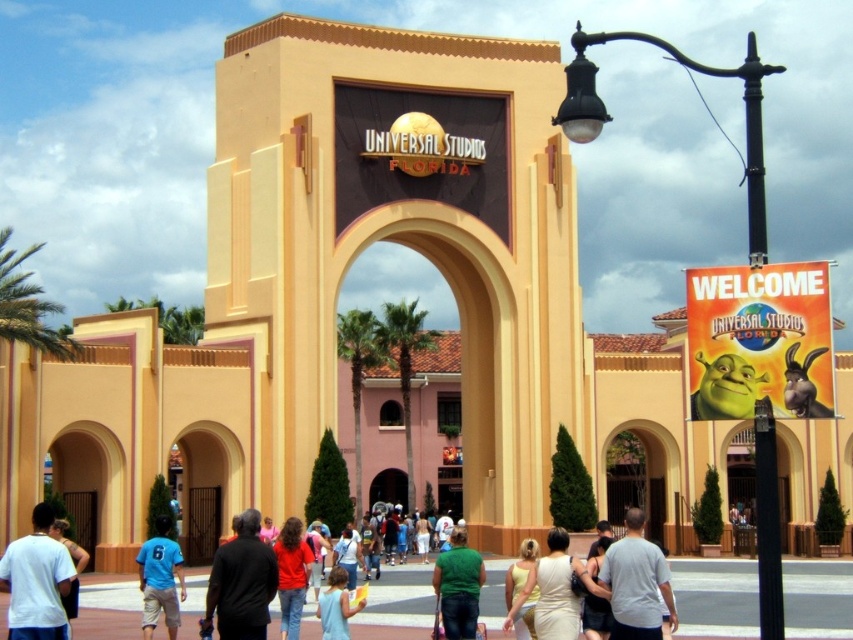
You are a photographer standing at the entrance of Universal Studios Florida. You want to take a photo of both the white cotton shirt at lower left and the green matte shirt at center in the same frame. Given that your camera has a 50mm lens, which has a field of view of approximately 46 degrees, can you fit both people into the frame without moving your position?

The white cotton shirt at lower left and green matte shirt at center are 13.43 meters apart from each other. With a 50mm lens providing a 46 degree field of view, the maximum distance between two objects that can be captured in the same frame would depend on their distance from the camera. However, since both are at the entrance and relatively close to the photographer, it is likely possible to capture both within the 46 degree field of view without moving.